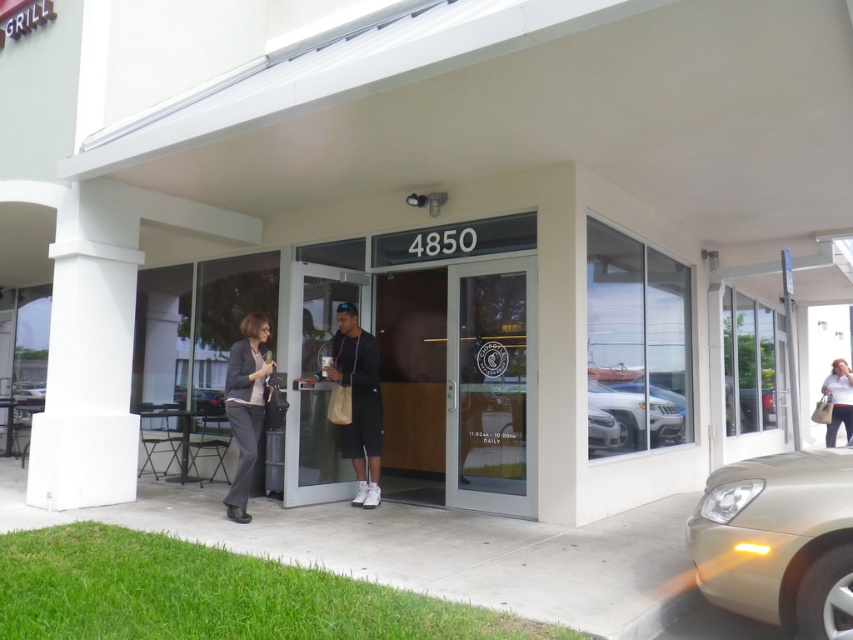
Question: Does white matte car at center appear on the right side of matte beige handbag at center?

Choices:
 (A) yes
 (B) no

Answer: (B)

Question: Is white matte car at center further to camera compared to matte beige handbag at center?

Choices:
 (A) yes
 (B) no

Answer: (B)

Question: Which point is closer to the camera taking this photo?

Choices:
 (A) (236, 442)
 (B) (337, 285)
 (C) (355, 356)

Answer: (A)

Question: In this image, where is white smooth column at left located relative to white matte car at center?

Choices:
 (A) right
 (B) left

Answer: (B)

Question: Which object is closer to the camera taking this photo?

Choices:
 (A) dark gray suit at center
 (B) clear glass door at center
 (C) gold metallic car at lower right

Answer: (C)

Question: Estimate the real-world distances between objects in this image. Which object is closer to the white matte car at center?

Choices:
 (A) gold metallic car at lower right
 (B) metallic silver car at lower left
 (C) clear glass door at center

Answer: (C)